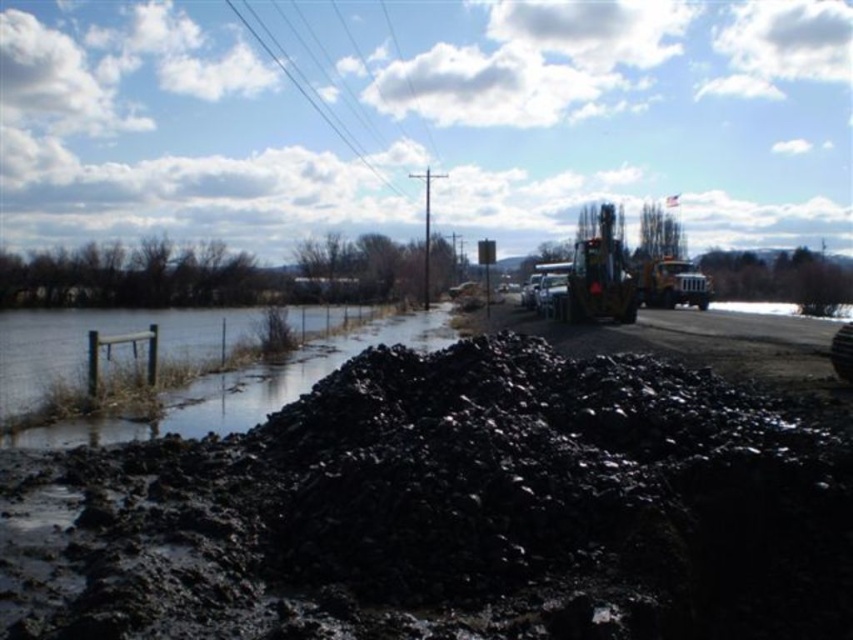
Based on the photo, does black mud at center have a lesser height compared to clear water at fence left?

Indeed, black mud at center has a lesser height compared to clear water at fence left.

At what (x,y) coordinates should I click in order to perform the action: click on black mud at center. Please return your answer as a coordinate pair (x, y). This screenshot has height=640, width=853. Looking at the image, I should click on (448, 512).

Find the location of a particular element. Image resolution: width=853 pixels, height=640 pixels. black mud at center is located at coordinates (448, 512).

How much distance is there between clear water at fence left and greenish-brown metallic excavator at center-right?

clear water at fence left and greenish-brown metallic excavator at center-right are 17.14 meters apart from each other.

Is point (123, 324) positioned before point (612, 282)?

No.

The image size is (853, 640). What do you see at coordinates (247, 387) in the screenshot?
I see `clear water at fence left` at bounding box center [247, 387].

This screenshot has height=640, width=853. Identify the location of clear water at fence left. (247, 387).

Can you confirm if black mud at center is wider than greenish-brown metallic excavator at center-right?

Incorrect, black mud at center's width does not surpass greenish-brown metallic excavator at center-right's.

Based on the photo, is black mud at center thinner than greenish-brown metallic excavator at center-right?

Result: Correct, black mud at center's width is less than greenish-brown metallic excavator at center-right's.

What do you see at coordinates (448, 512) in the screenshot? I see `black mud at center` at bounding box center [448, 512].

I want to click on black mud at center, so click(x=448, y=512).